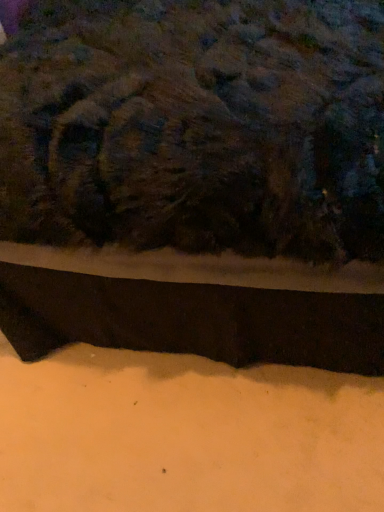
At what (x,y) coordinates should I click in order to perform the action: click on matte brown rock at center. Please return your answer as a coordinate pair (x, y). The width and height of the screenshot is (384, 512). Looking at the image, I should click on (196, 126).

Image resolution: width=384 pixels, height=512 pixels. Describe the element at coordinates (196, 126) in the screenshot. I see `matte brown rock at center` at that location.

Where is `matte brown rock at center`? The image size is (384, 512). matte brown rock at center is located at coordinates (196, 126).